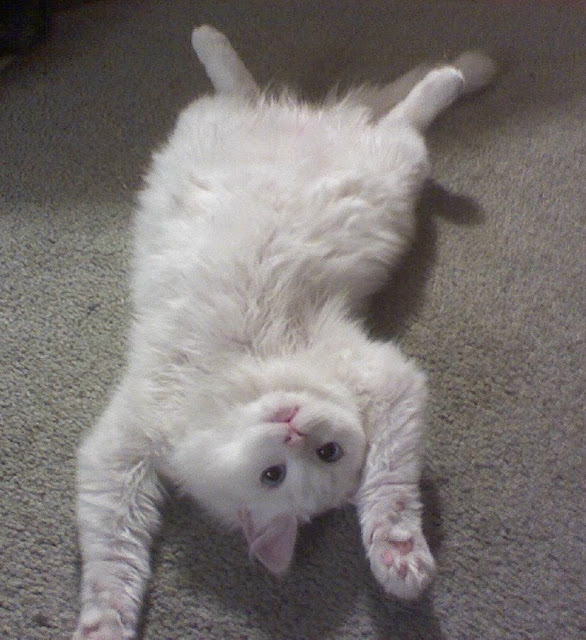
This screenshot has width=586, height=640. Find the location of `carpet`. carpet is located at coordinates (514, 545), (64, 372), (183, 607), (483, 361).